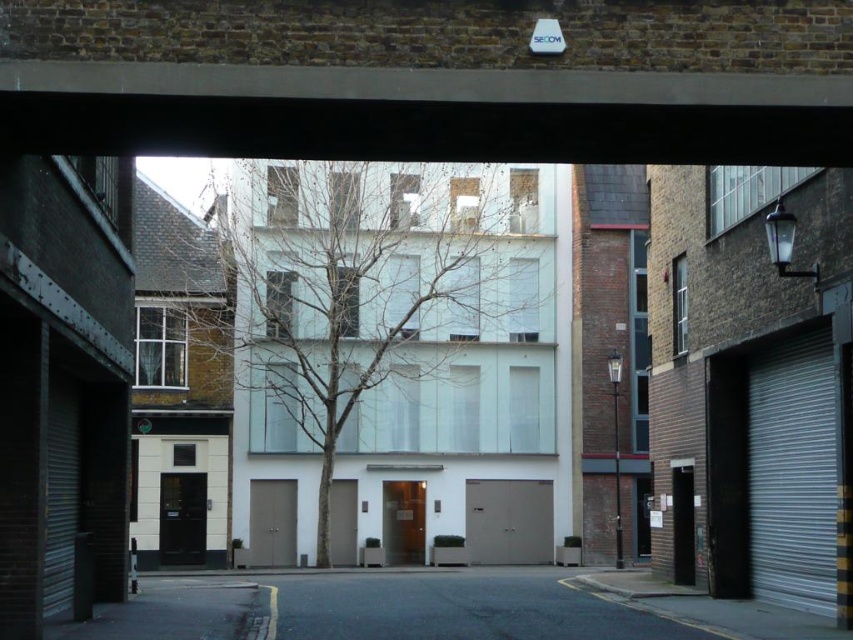
Is concrete at upper center closer to camera compared to metallic gray garage door at center?

Yes, concrete at upper center is in front of metallic gray garage door at center.

Which is in front, point (161, 116) or point (543, 524)?

Positioned in front is point (161, 116).

The image size is (853, 640). In order to click on concrete at upper center in this screenshot , I will do `click(427, 113)`.